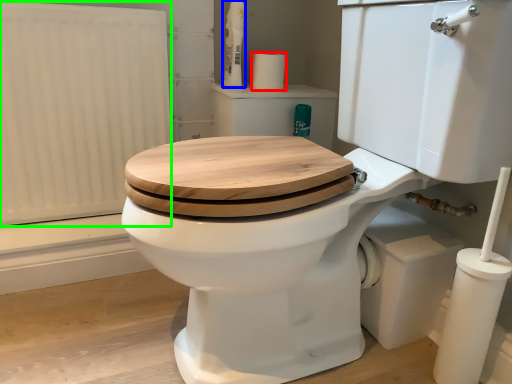
Question: Estimate the real-world distances between objects in this image. Which object is closer to toilet paper (highlighted by a red box), toiletry (highlighted by a blue box) or radiator (highlighted by a green box)?

Choices:
 (A) toiletry
 (B) radiator

Answer: (A)